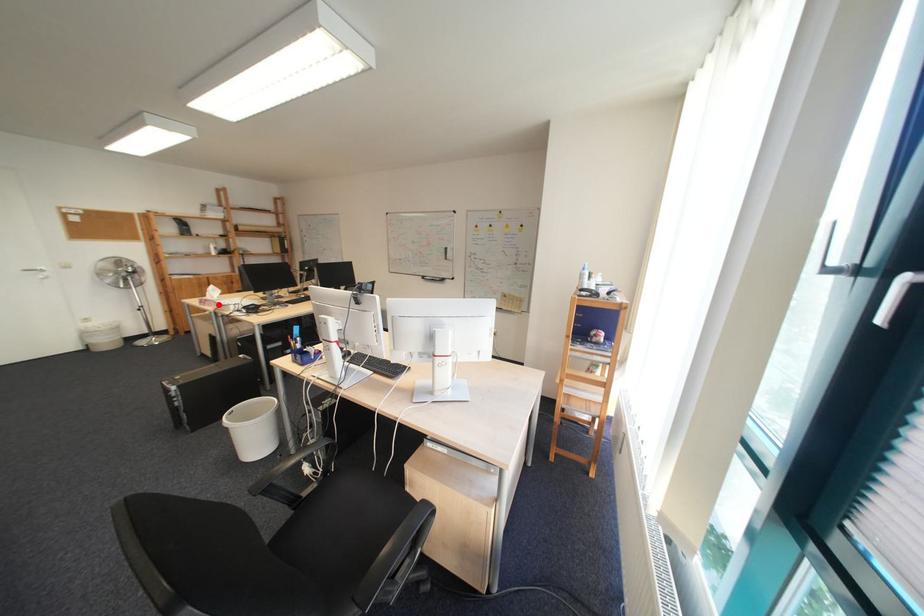
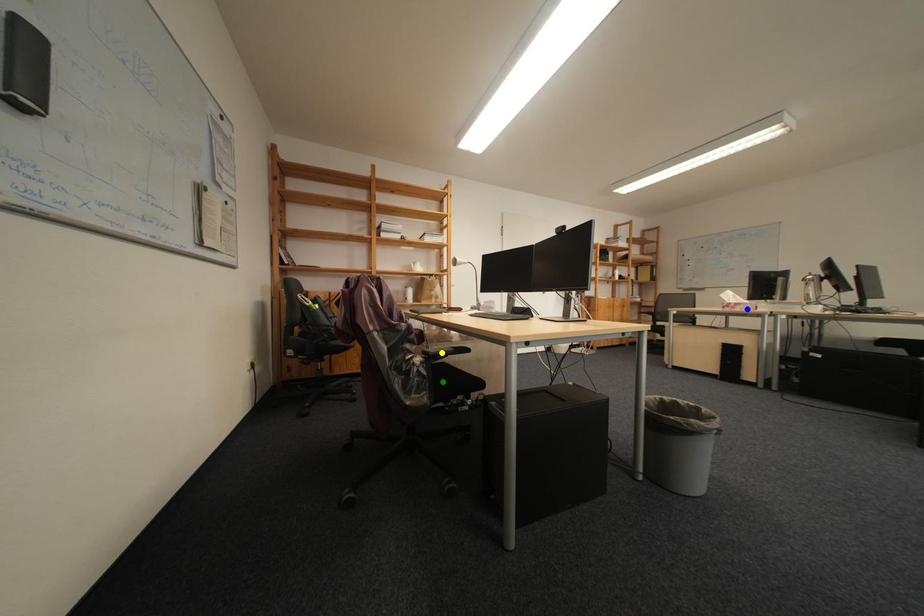
Question: I am providing you with two images of the same scene from different viewpoints. A red point is marked on the first image. You are given multiple points on the second image. In image 2, which mark is for the same physical point as the one in image 1?

Choices:
 (A) yellow point
 (B) blue point
 (C) green point

Answer: (B)